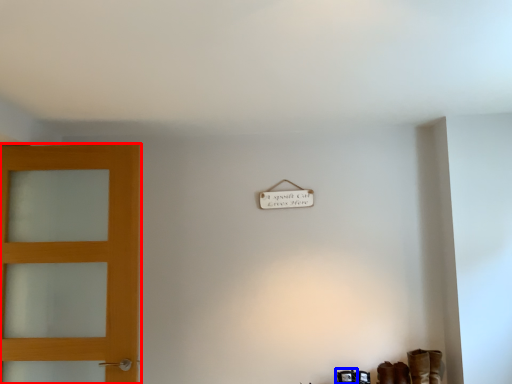
Question: Which point is closer to the camera, door (highlighted by a red box) or shoe (highlighted by a blue box)?

Choices:
 (A) door
 (B) shoe

Answer: (A)